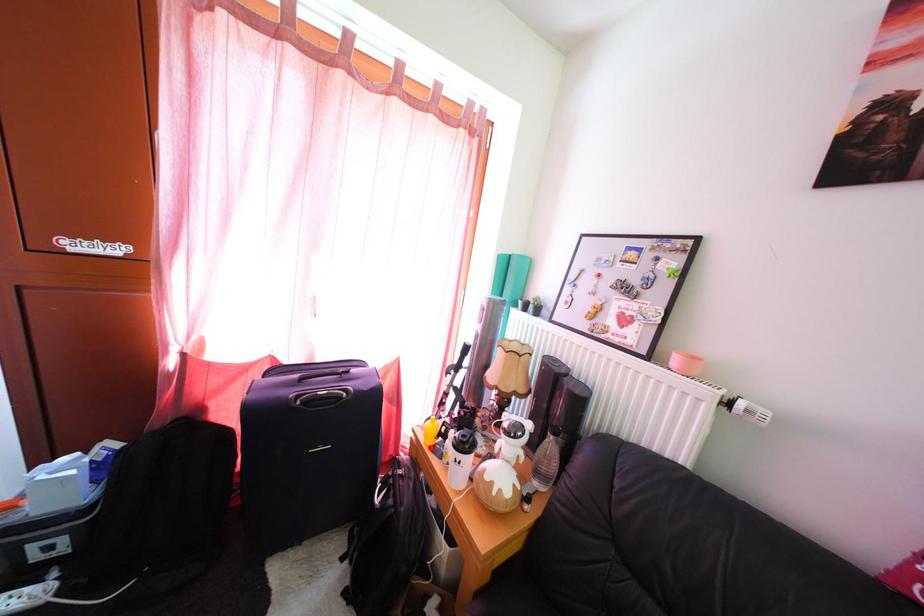
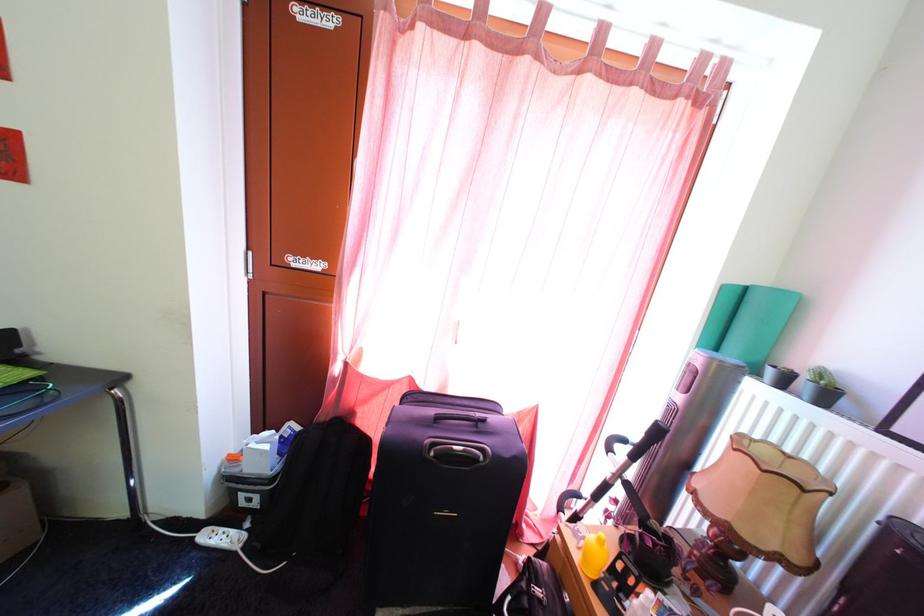
Question: I am providing you with two images of the same scene from different viewpoints. In image1, a red point is highlighted. Considering the same 3D point in image2, which of the following is correct?

Choices:
 (A) It is closer
 (B) It is farther

Answer: (B)